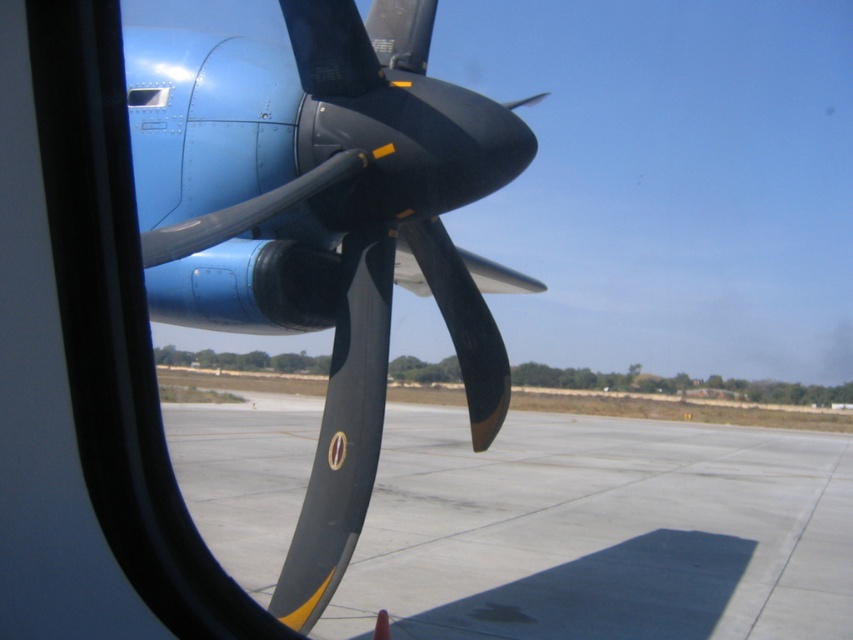
Question: Which of the following is the closest to the observer?

Choices:
 (A) transparent glass airplane window at upper left
 (B) gray concrete tarmac at center

Answer: (B)

Question: Is matte black propeller at center further to the viewer compared to transparent glass airplane window at upper left?

Choices:
 (A) no
 (B) yes

Answer: (A)

Question: Among these objects, which one is nearest to the camera?

Choices:
 (A) matte black propeller at center
 (B) transparent glass airplane window at upper left
 (C) gray concrete tarmac at center

Answer: (A)

Question: Can you confirm if gray concrete tarmac at center is wider than transparent glass airplane window at upper left?

Choices:
 (A) yes
 (B) no

Answer: (A)

Question: Estimate the real-world distances between objects in this image. Which object is farther from the transparent glass airplane window at upper left?

Choices:
 (A) matte black propeller at center
 (B) gray concrete tarmac at center

Answer: (B)

Question: Can you confirm if gray concrete tarmac at center is positioned above matte black propeller at center?

Choices:
 (A) yes
 (B) no

Answer: (B)